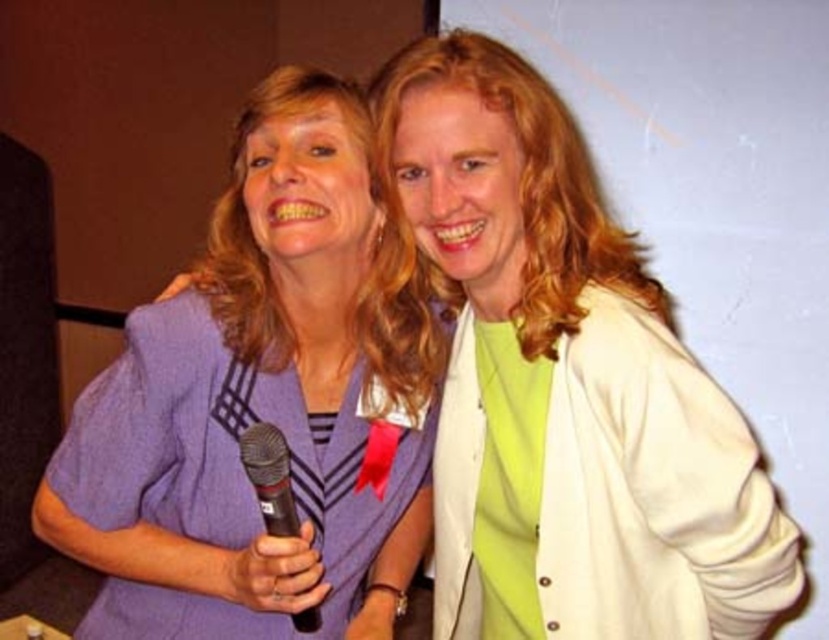
Does purple woolen blazer at left lie behind black matte microphone at center?

Yes, purple woolen blazer at left is further from the viewer.

Between purple woolen blazer at left and black matte microphone at center, which one appears on the left side from the viewer's perspective?

black matte microphone at center is more to the left.

The height and width of the screenshot is (640, 829). What do you see at coordinates (255, 403) in the screenshot? I see `purple woolen blazer at left` at bounding box center [255, 403].

I want to click on purple woolen blazer at left, so click(255, 403).